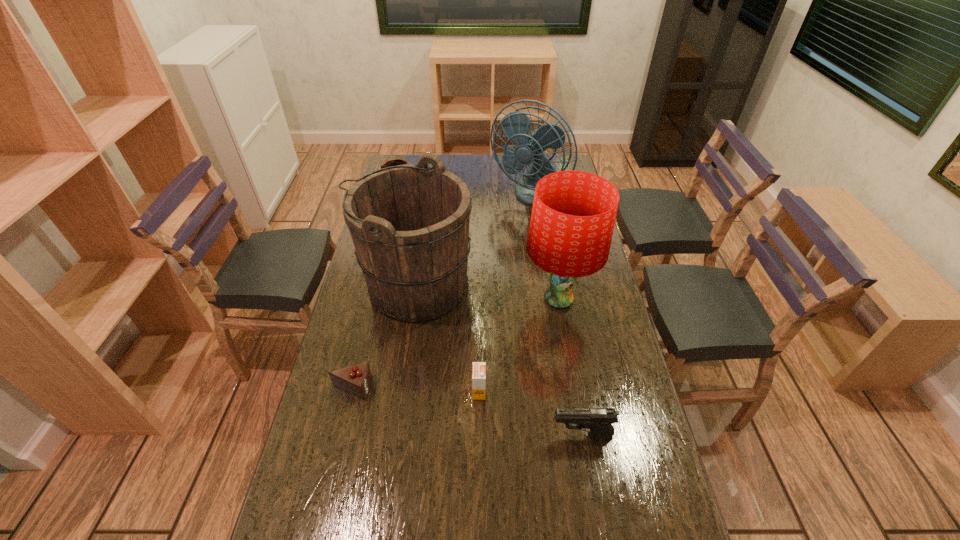
Image resolution: width=960 pixels, height=540 pixels. I want to click on fan, so click(x=515, y=125).

You are a GUI agent. You are given a task and a screenshot of the screen. Output one action in this format:
    pyautogui.click(x=<x>, y=<y>)
    Task: Click on the lampshade
    Image resolution: width=960 pixels, height=540 pixels.
    Given the screenshot: What is the action you would take?
    pyautogui.click(x=573, y=215)

At what (x,y) coordinates should I click in order to perform the action: click on bucket. Please return your answer as a coordinate pair (x, y). Looking at the image, I should click on (409, 223).

Where is `the fourth tallest object`? The image size is (960, 540). the fourth tallest object is located at coordinates (394, 162).

This screenshot has height=540, width=960. What are the coordinates of `pistol` in the screenshot? It's located at (599, 420).

Find the location of a particular element. the fourth object from right to left is located at coordinates pos(478,368).

At what (x,y) coordinates should I click in order to perform the action: click on the shortest object. Please return your answer as a coordinate pair (x, y). Looking at the image, I should click on (356, 379).

Find the location of a particular element. The height and width of the screenshot is (540, 960). vacant position located 0.290m in front of the fan to blow air is located at coordinates (536, 263).

The image size is (960, 540). In order to click on vacant space located 0.100m on the front-facing side of the lampshade in this screenshot , I will do `click(492, 300)`.

You are a GUI agent. You are given a task and a screenshot of the screen. Output one action in this format:
    pyautogui.click(x=<x>, y=<y>)
    Task: Click on the vacant space situated 0.340m on the front-facing side of the lampshade
    
    Given the screenshot: What is the action you would take?
    pyautogui.click(x=422, y=300)